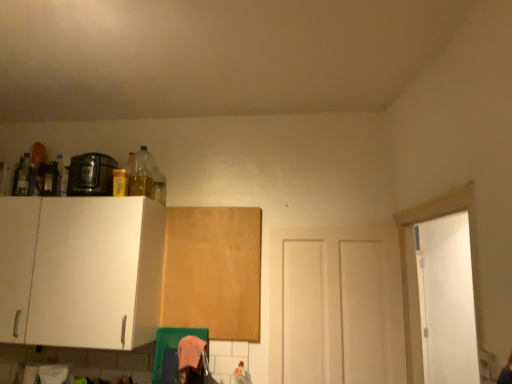
Question: Considering the positions of white matte door at center and wooden board at center, which ranks as the 2th cabinetry in left-to-right order, in the image, is white matte door at center bigger or smaller than wooden board at center, which ranks as the 2th cabinetry in left-to-right order,?

Choices:
 (A) big
 (B) small

Answer: (A)

Question: Is point (371, 349) positioned closer to the camera than point (237, 221)?

Choices:
 (A) closer
 (B) farther

Answer: (A)

Question: Estimate the real-world distances between objects in this image. Which object is closer to the shiny black toaster at upper left?

Choices:
 (A) white matte door at center
 (B) wooden board at center, which ranks as the 2th cabinetry in left-to-right order
 (C) white matte cabinet at left, the first cabinetry positioned from the left

Answer: (C)

Question: Based on their relative distances, which object is nearer to the shiny black toaster at upper left?

Choices:
 (A) white matte door at center
 (B) wooden board at center, which ranks as the 2th cabinetry in left-to-right order
 (C) white matte cabinet at left, the second cabinetry in the right-to-left sequence

Answer: (C)